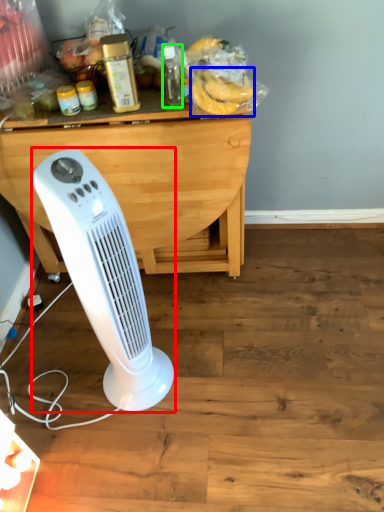
Question: Which is farther away from home appliance (highlighted by a red box)? banana (highlighted by a blue box) or bottle (highlighted by a green box)?

Choices:
 (A) banana
 (B) bottle

Answer: (B)